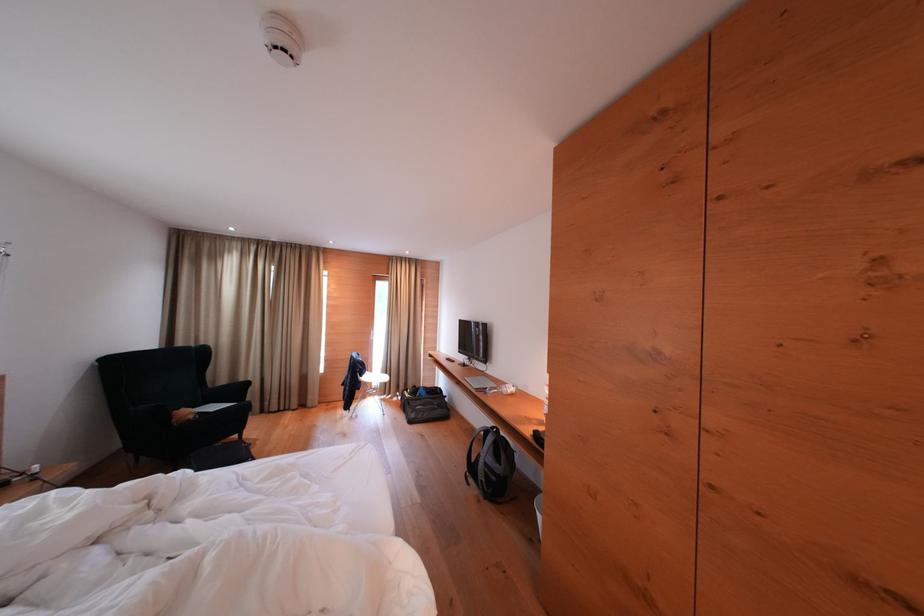
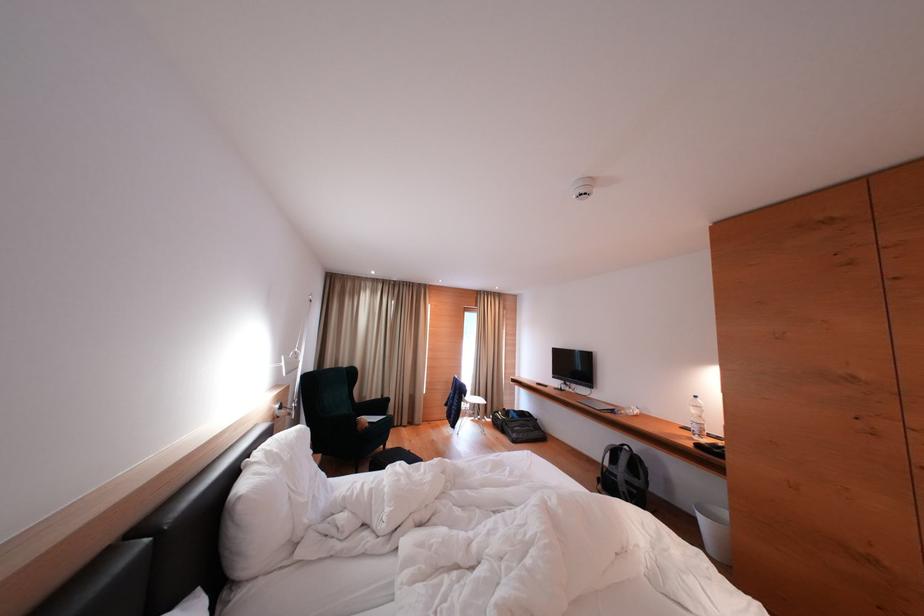
Where in the second image is the point corresponding to pixel 535 436 from the first image?

(696, 448)